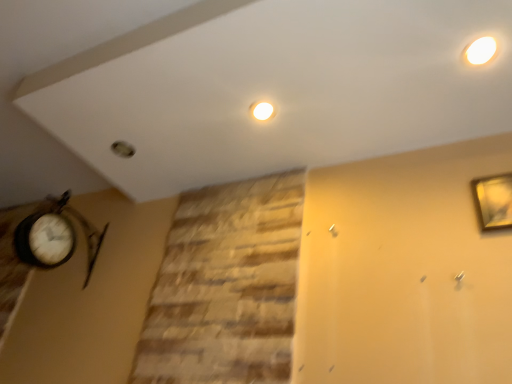
Question: Is point (470, 44) positioned closer to the camera than point (500, 210)?

Choices:
 (A) farther
 (B) closer

Answer: (B)

Question: Considering the positions of white glossy light fixture at upper right and gold metallic picture frame at upper right in the image, is white glossy light fixture at upper right bigger or smaller than gold metallic picture frame at upper right?

Choices:
 (A) small
 (B) big

Answer: (A)

Question: From a real-world perspective, relative to gold metallic picture frame at upper right, is white glossy light fixture at upper right vertically above or below?

Choices:
 (A) above
 (B) below

Answer: (A)

Question: Is gold metallic picture frame at upper right taller or shorter than white glossy light fixture at upper right?

Choices:
 (A) tall
 (B) short

Answer: (A)

Question: Considering the relative positions of gold metallic picture frame at upper right and white glossy light fixture at upper right in the image provided, is gold metallic picture frame at upper right to the left or to the right of white glossy light fixture at upper right?

Choices:
 (A) left
 (B) right

Answer: (B)

Question: Is gold metallic picture frame at upper right inside or outside of white glossy light fixture at upper right?

Choices:
 (A) outside
 (B) inside

Answer: (A)

Question: From the image's perspective, is gold metallic picture frame at upper right located above or below white glossy light fixture at upper right?

Choices:
 (A) below
 (B) above

Answer: (A)